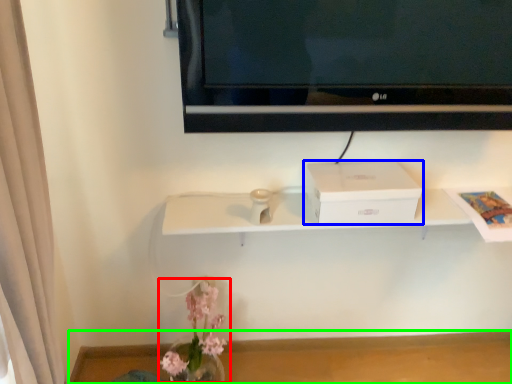
Question: Considering the real-world distances, which object is closest to floral arrangement (highlighted by a red box)? box (highlighted by a blue box) or table (highlighted by a green box).

Choices:
 (A) box
 (B) table

Answer: (B)